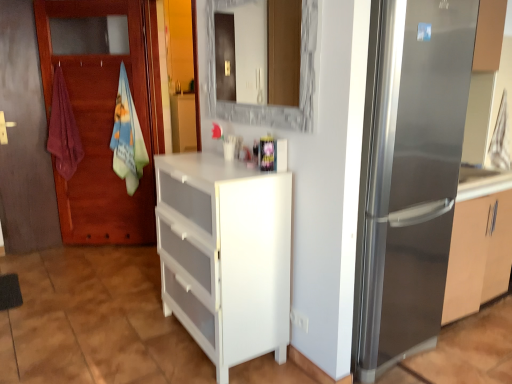
At what (x,y) coordinates should I click in order to perform the action: click on free spot below maroon cotton towel at left, positioned as the second beach towel in right-to-left order (from a real-world perspective). Please return your answer as a coordinate pair (x, y). The width and height of the screenshot is (512, 384). Looking at the image, I should click on tap(78, 245).